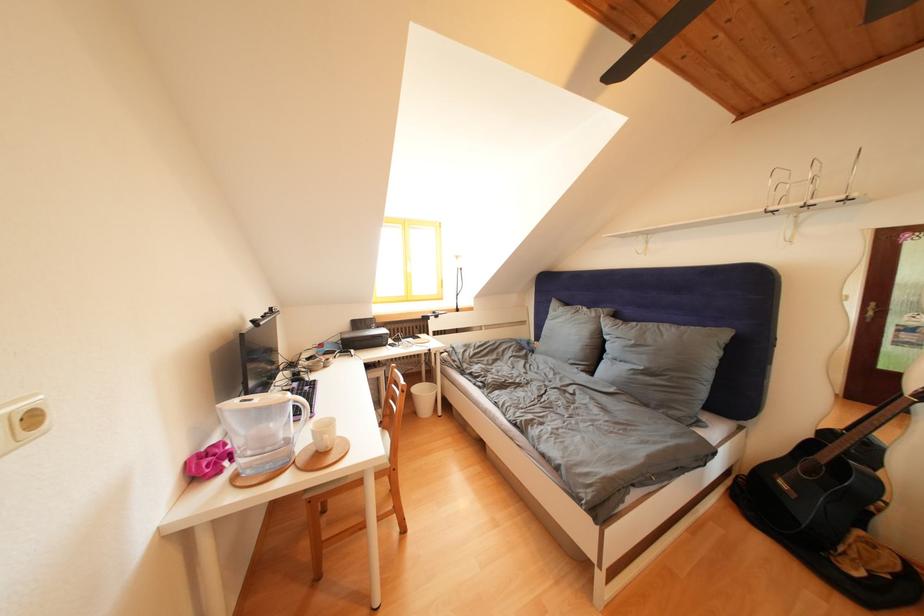
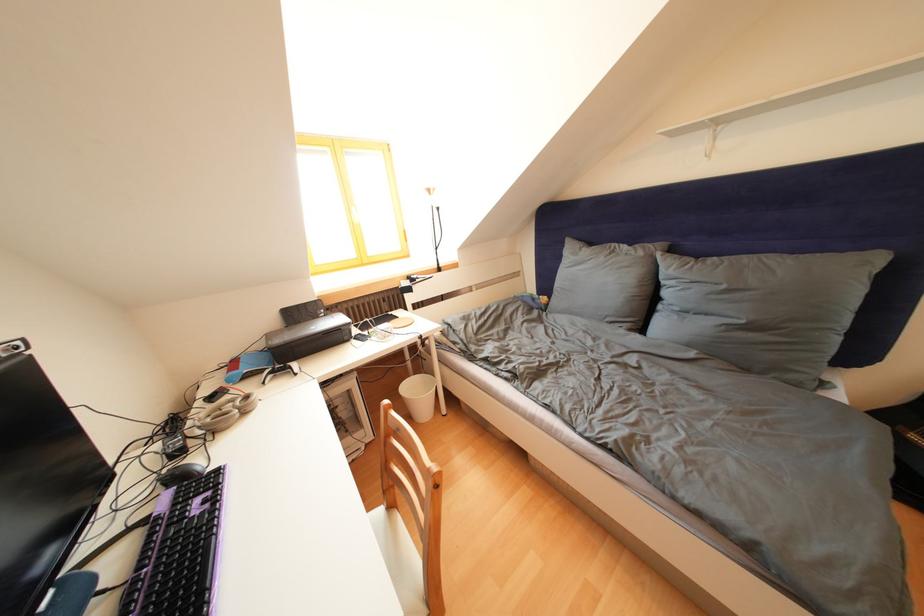
The point at (317, 363) is marked in the first image. Where is the corresponding point in the second image?

(220, 403)